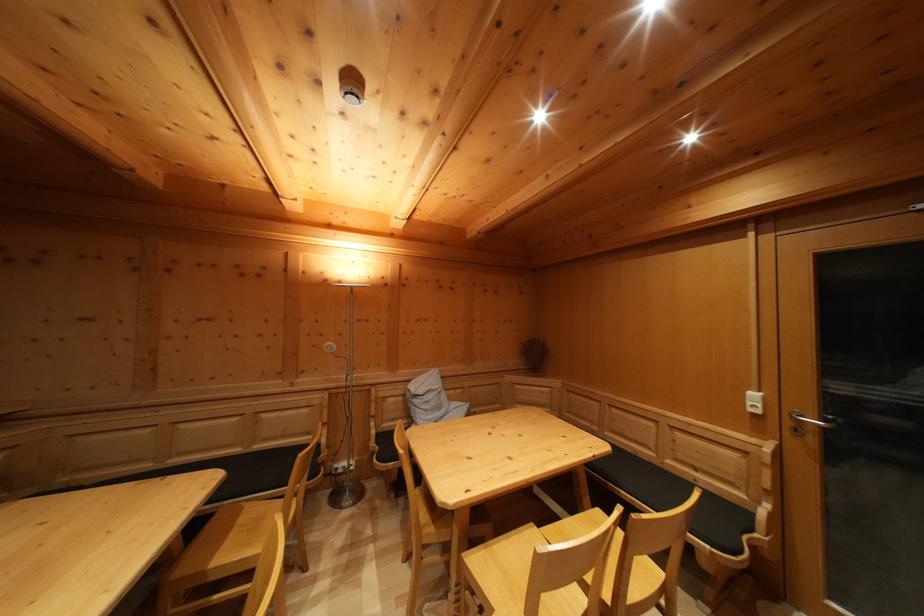
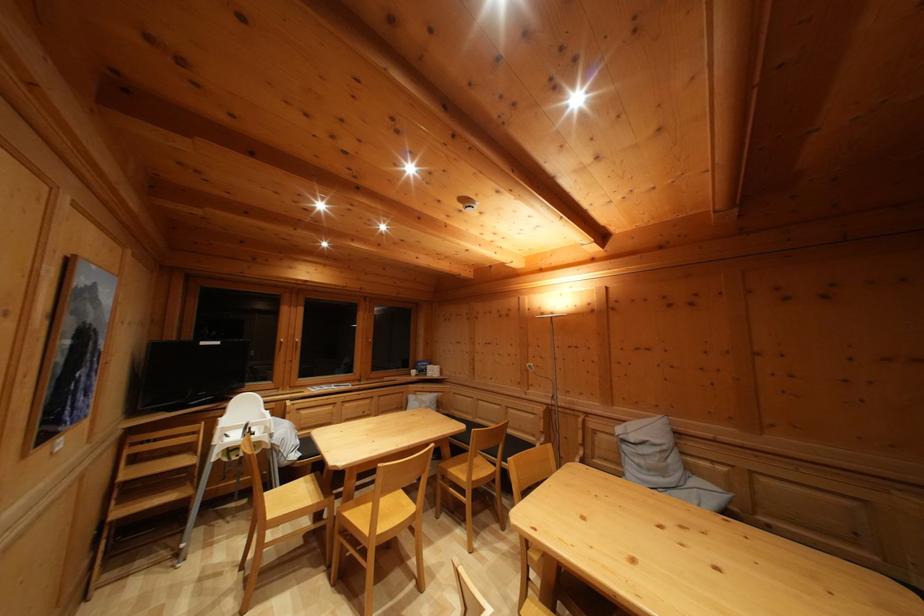
Locate, in the second image, the point that corresponds to (x=420, y=408) in the first image.

(629, 454)